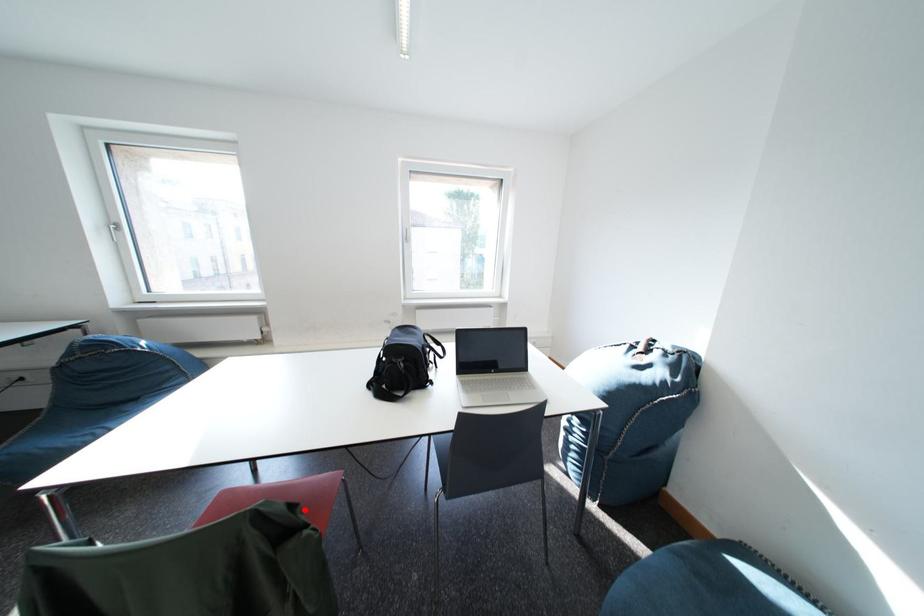
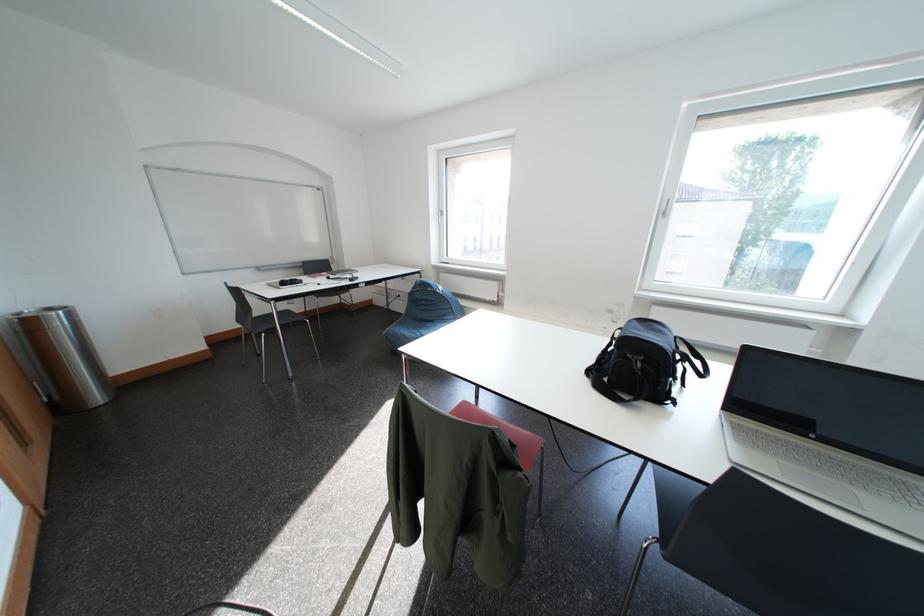
Question: I am providing you with two images of the same scene from different viewpoints. Given a red point in image1, look at the same physical point in image2. Is it:

Choices:
 (A) Closer to the viewpoint
 (B) Farther from the viewpoint

Answer: (A)